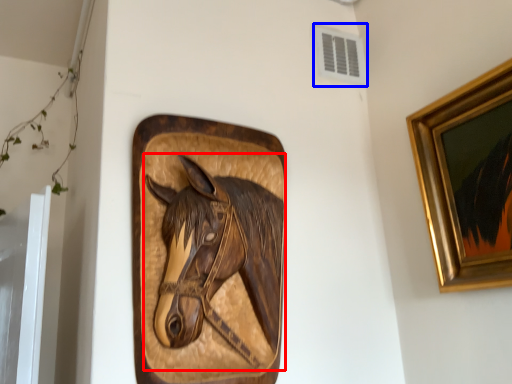
Question: Which of the following is the closest to the observer, horse (highlighted by a red box) or air conditioning (highlighted by a blue box)?

Choices:
 (A) horse
 (B) air conditioning

Answer: (A)